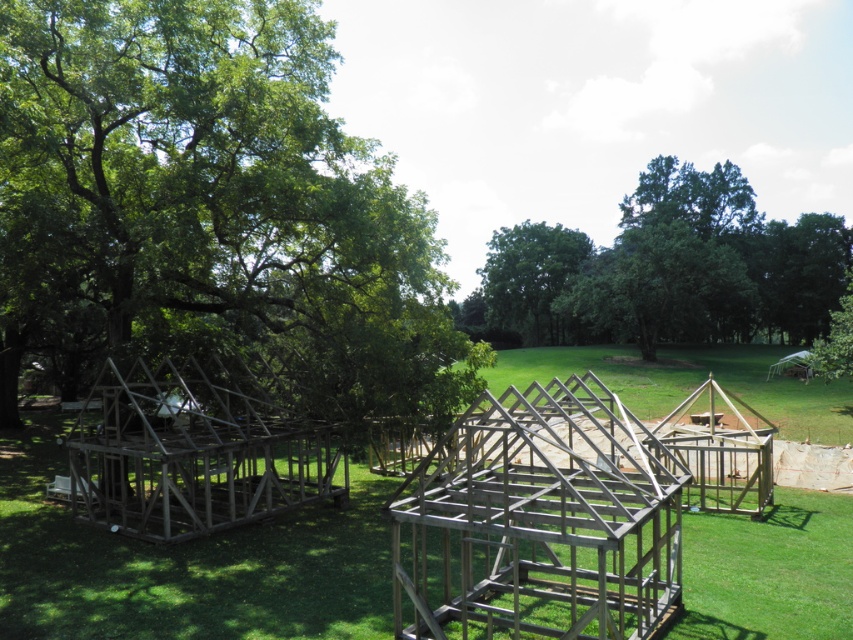
You are a landscape architect designing a garden path between the green leafy tree at left and the green leafy tree at center. Which tree should you consider as the larger one when planning the pathway width?

The green leafy tree at left is bigger than the green leafy tree at center, so you should consider the green leafy tree at left as the larger one when planning the pathway width.